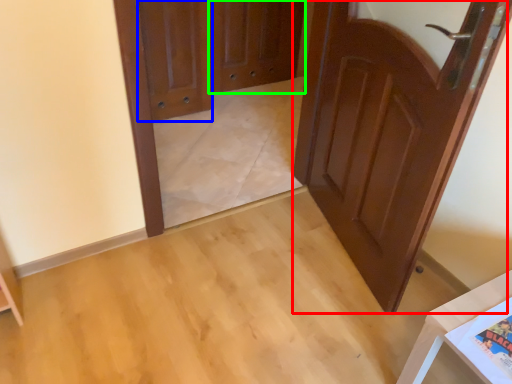
Question: Which object is positioned farthest from door (highlighted by a red box)? Select from door (highlighted by a blue box) and screen door (highlighted by a green box).

Choices:
 (A) door
 (B) screen door

Answer: (B)